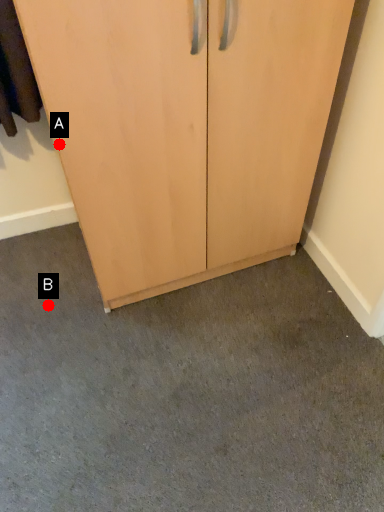
Question: Two points are circled on the image, labeled by A and B beside each circle. Which point is farther to the camera?

Choices:
 (A) A is further
 (B) B is further

Answer: (B)